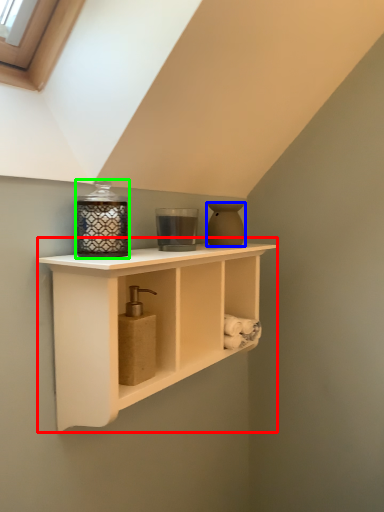
Question: Estimate the real-world distances between objects in this image. Which object is farther from shelf (highlighted by a red box), vase (highlighted by a blue box) or candle holder (highlighted by a green box)?

Choices:
 (A) vase
 (B) candle holder

Answer: (A)